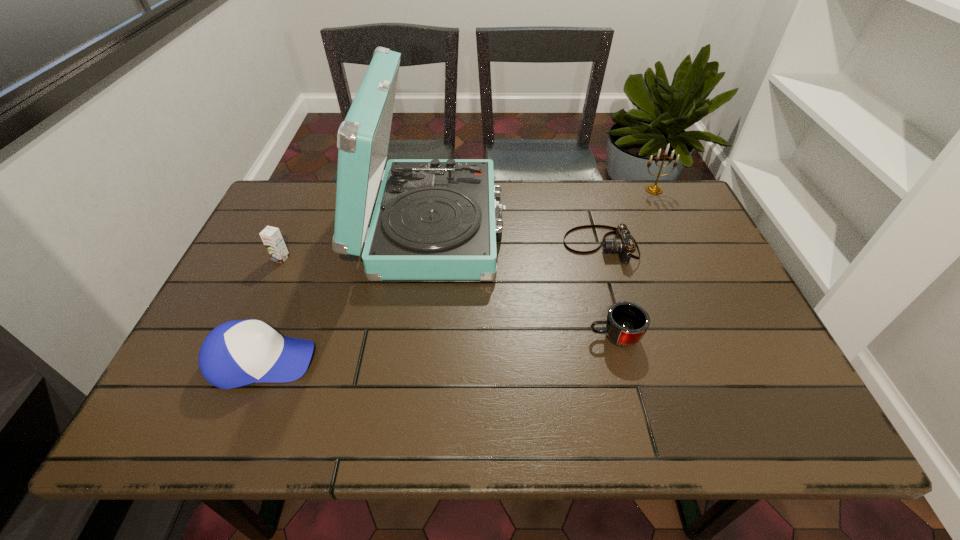
Locate an element on the screen. The image size is (960, 540). vacant space situated on the back of the chocolate milk is located at coordinates (306, 202).

Locate an element on the screen. The image size is (960, 540). vacant space located 0.190m on the front-facing side of the baseball cap is located at coordinates (402, 361).

You are a GUI agent. You are given a task and a screenshot of the screen. Output one action in this format:
    pyautogui.click(x=<x>, y=<y>)
    Task: Click on the vacant space located 0.360m on the side of the mug with the handle
    This screenshot has width=960, height=540.
    Given the screenshot: What is the action you would take?
    pyautogui.click(x=431, y=336)

Where is `free location located on the side of the mug with the handle`? free location located on the side of the mug with the handle is located at coordinates (448, 336).

This screenshot has width=960, height=540. In order to click on free space located 0.100m on the side of the mug with the handle in this screenshot , I will do `click(544, 336)`.

Locate an element on the screen. free space located on the front-facing side of the shortest object is located at coordinates (439, 246).

Where is `vacant space located on the front-facing side of the shortest object`? vacant space located on the front-facing side of the shortest object is located at coordinates (524, 246).

Where is `vacant space located on the front-facing side of the shortest object`? The height and width of the screenshot is (540, 960). vacant space located on the front-facing side of the shortest object is located at coordinates (521, 246).

Identify the location of record player situated at the far edge. tap(435, 219).

Find the location of `candelabrum present at the far edge`. candelabrum present at the far edge is located at coordinates (652, 189).